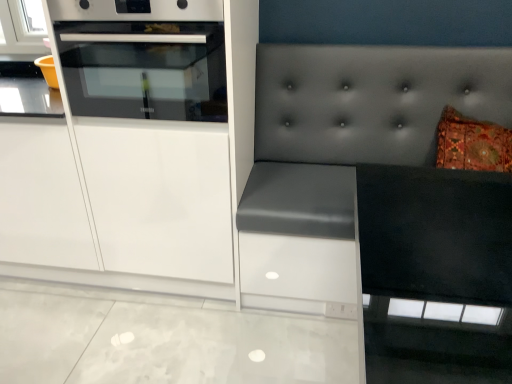
Where is `matte gray cushion at right`? The height and width of the screenshot is (384, 512). matte gray cushion at right is located at coordinates (344, 149).

Would you say white glossy oven at upper left is to the left or to the right of matte gray cushion at right in the picture?

Clearly, white glossy oven at upper left is on the left of matte gray cushion at right in the image.

From a real-world perspective, is white glossy oven at upper left on matte gray cushion at right?

Yes.

Considering the sizes of objects white glossy oven at upper left and matte gray cushion at right in the image provided, who is wider, white glossy oven at upper left or matte gray cushion at right?

With larger width is white glossy oven at upper left.

Which of these two, white glossy cabinet at left or white glossy oven at upper left, is bigger?

white glossy cabinet at left is bigger.

You are a GUI agent. You are given a task and a screenshot of the screen. Output one action in this format:
    pyautogui.click(x=<x>, y=<y>)
    Task: Click on the cabinetry on the right of white glossy oven at upper left
    Image resolution: width=512 pixels, height=384 pixels.
    Given the screenshot: What is the action you would take?
    pyautogui.click(x=136, y=149)

Is white glossy cabinet at left shorter than white glossy oven at upper left?

Result: No, white glossy cabinet at left is not shorter than white glossy oven at upper left.

Does white glossy cabinet at left turn towards white glossy oven at upper left?

Yes, white glossy cabinet at left is facing white glossy oven at upper left.

Considering the points (108, 89) and (372, 136), which point is behind, point (108, 89) or point (372, 136)?

Positioned behind is point (372, 136).

Is white glossy cabinet at left spatially inside matte gray cushion at right, or outside of it?

white glossy cabinet at left is not inside matte gray cushion at right, it's outside.

Which is more to the left, white glossy cabinet at left or matte gray cushion at right?

From the viewer's perspective, white glossy cabinet at left appears more on the left side.

Can you confirm if white glossy cabinet at left is shorter than matte gray cushion at right?

Incorrect, the height of white glossy cabinet at left does not fall short of that of matte gray cushion at right.

Can you tell me how much matte gray cushion at right and white glossy oven at upper left differ in facing direction?

Answer: The angle between the facing direction of matte gray cushion at right and the facing direction of white glossy oven at upper left is 0.804 degrees.

Looking at this image, would you say white glossy oven at upper left is part of matte gray cushion at right's contents?

No, white glossy oven at upper left is not a part of matte gray cushion at right.

Who is more distant, matte gray cushion at right or white glossy oven at upper left?

white glossy oven at upper left is behind.

Which object is thinner, matte gray cushion at right or white glossy oven at upper left?

Thinner between the two is matte gray cushion at right.

Considering the relative positions of white glossy oven at upper left and white glossy cabinet at left in the image provided, is white glossy oven at upper left to the left or to the right of white glossy cabinet at left?

white glossy oven at upper left is positioned on white glossy cabinet at left's left side.

Is point (97, 81) positioned before point (135, 95)?

No, (97, 81) is further to viewer.

Consider the image. Does white glossy oven at upper left have a larger size compared to white glossy cabinet at left?

Incorrect, white glossy oven at upper left is not larger than white glossy cabinet at left.

Based on the photo, would you say white glossy cabinet at left is part of matte gray cushion at right's contents?

Actually, white glossy cabinet at left is outside matte gray cushion at right.

How distant is matte gray cushion at right from white glossy cabinet at left?

matte gray cushion at right is 21.00 inches from white glossy cabinet at left.

Is matte gray cushion at right bigger than white glossy cabinet at left?

Correct, matte gray cushion at right is larger in size than white glossy cabinet at left.

Looking at their sizes, would you say matte gray cushion at right is wider or thinner than white glossy cabinet at left?

matte gray cushion at right is wider than white glossy cabinet at left.

The image size is (512, 384). In order to click on couch directly beneath the white glossy oven at upper left (from a real-world perspective) in this screenshot , I will do `click(344, 149)`.

At what (x,y) coordinates should I click in order to perform the action: click on cabinetry that is behind the white glossy oven at upper left. Please return your answer as a coordinate pair (x, y). The width and height of the screenshot is (512, 384). Looking at the image, I should click on (136, 149).

Which object lies nearer to the anchor point matte gray cushion at right, white glossy cabinet at left or white glossy oven at upper left?

white glossy cabinet at left is positioned closer to the anchor matte gray cushion at right.

Looking at the image, which one is located further to white glossy oven at upper left, white glossy cabinet at left or matte gray cushion at right?

matte gray cushion at right is further to white glossy oven at upper left.

Which object lies nearer to the anchor point white glossy cabinet at left, matte gray cushion at right or white glossy oven at upper left?

white glossy oven at upper left lies closer to white glossy cabinet at left than the other object.

Considering their positions, is matte gray cushion at right positioned closer to white glossy oven at upper left than white glossy cabinet at left?

Based on the image, white glossy cabinet at left appears to be nearer to white glossy oven at upper left.

Looking at the image, which one is located closer to matte gray cushion at right, white glossy oven at upper left or white glossy cabinet at left?

Among the two, white glossy cabinet at left is located nearer to matte gray cushion at right.

Estimate the real-world distances between objects in this image. Which object is further from white glossy cabinet at left, white glossy oven at upper left or matte gray cushion at right?

Among the two, matte gray cushion at right is located further to white glossy cabinet at left.

Locate an element on the screen. Image resolution: width=512 pixels, height=384 pixels. cabinetry between white glossy oven at upper left and matte gray cushion at right from left to right is located at coordinates (136, 149).